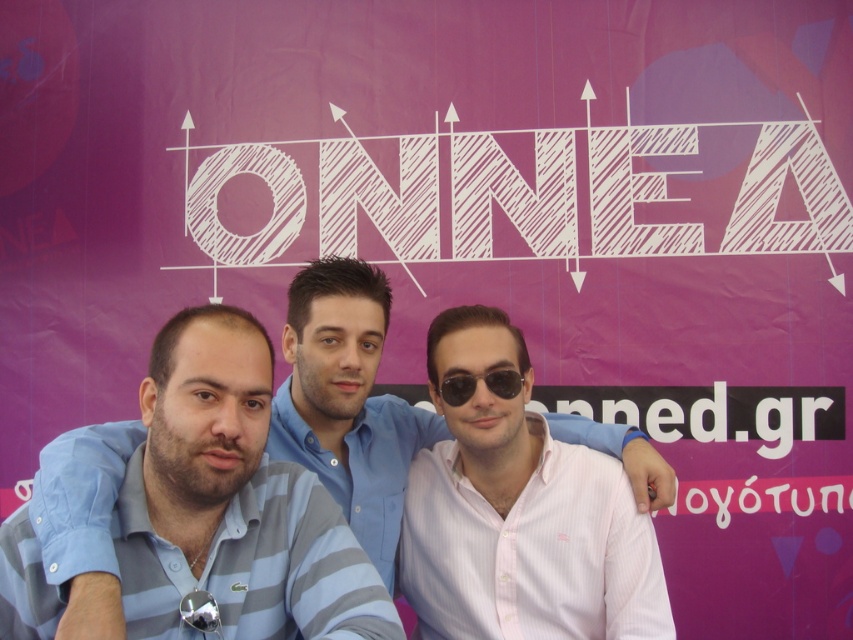
Can you confirm if blue striped polo shirt at center is positioned above black plastic sunglasses at center?

No.

Image resolution: width=853 pixels, height=640 pixels. I want to click on blue striped polo shirt at center, so click(231, 502).

I want to click on blue striped polo shirt at center, so click(x=231, y=502).

Does blue striped polo shirt at center appear on the right side of pink striped shirt at center?

No, blue striped polo shirt at center is not to the right of pink striped shirt at center.

How distant is blue striped polo shirt at center from pink striped shirt at center?

blue striped polo shirt at center and pink striped shirt at center are 34.15 inches apart.

Is point (142, 540) positioned in front of point (538, 538)?

Yes, it is.

Identify the location of blue striped polo shirt at center. (231, 502).

Does pink striped shirt at center have a larger size compared to black plastic sunglasses at center?

Yes, pink striped shirt at center is bigger than black plastic sunglasses at center.

Which is below, pink striped shirt at center or black plastic sunglasses at center?

pink striped shirt at center

Who is more forward, (x=582, y=602) or (x=491, y=388)?

Point (x=582, y=602) is more forward.

Locate an element on the screen. pink striped shirt at center is located at coordinates (531, 552).